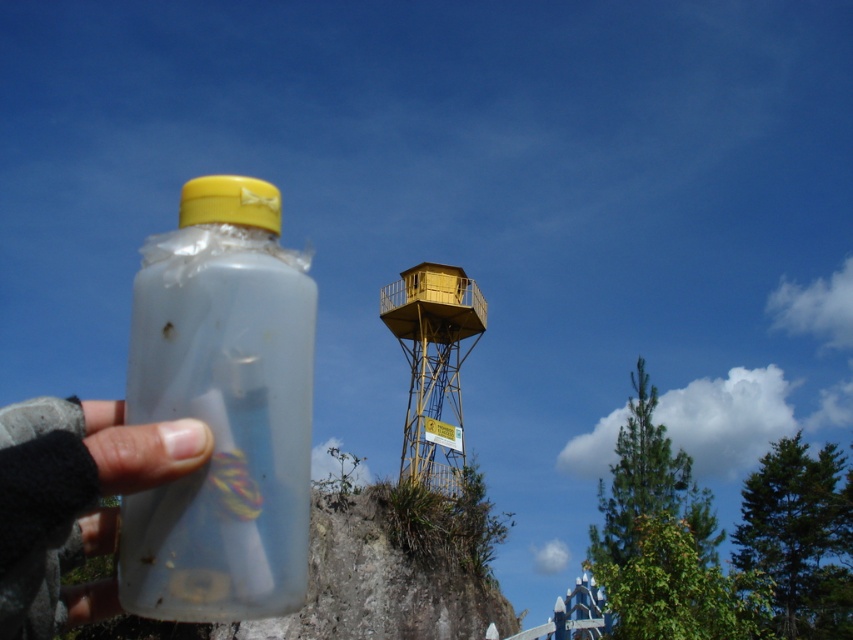
You are a photographer holding a transparent plastic bottle at center. You want to take a photo of the yellow matte water tower at center in the background. Can you see the tower clearly through the bottle?

The transparent plastic bottle at center is above the yellow matte water tower at center, so you can see the tower through the bottle as long as the bottle is held in a way that allows the tower to be in the background.

You are a photographer trying to capture both the transparent plastic bottle at lower left and the yellow matte water tower at center in a single frame. Given their sizes in the image, which object would you need to position closer to the camera to ensure both are visible clearly?

Since the transparent plastic bottle at lower left occupies less space than the yellow matte water tower at center, you would need to move the transparent plastic bottle at lower left closer to the camera to make it appear larger in the frame, ensuring both objects are visible clearly.

You are a delivery drone with a 30 cm wide package. You need to fly through the space between the transparent plastic bottle at center and the transparent plastic bottle at lower left. Can you fit through the space between them?

The distance between the transparent plastic bottle at center and the transparent plastic bottle at lower left is 31.87 centimeters, so the drone can fit through since the package is only 30 cm wide.